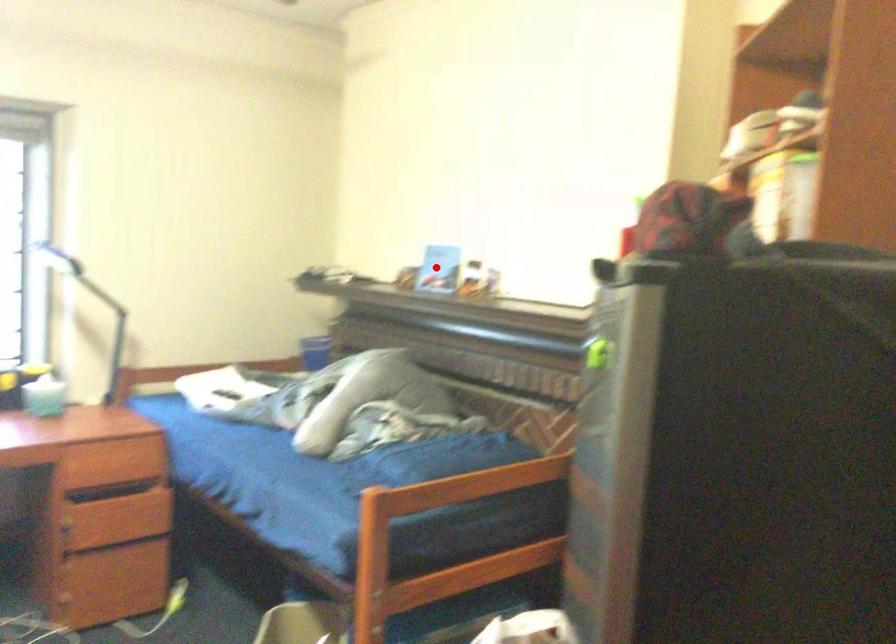
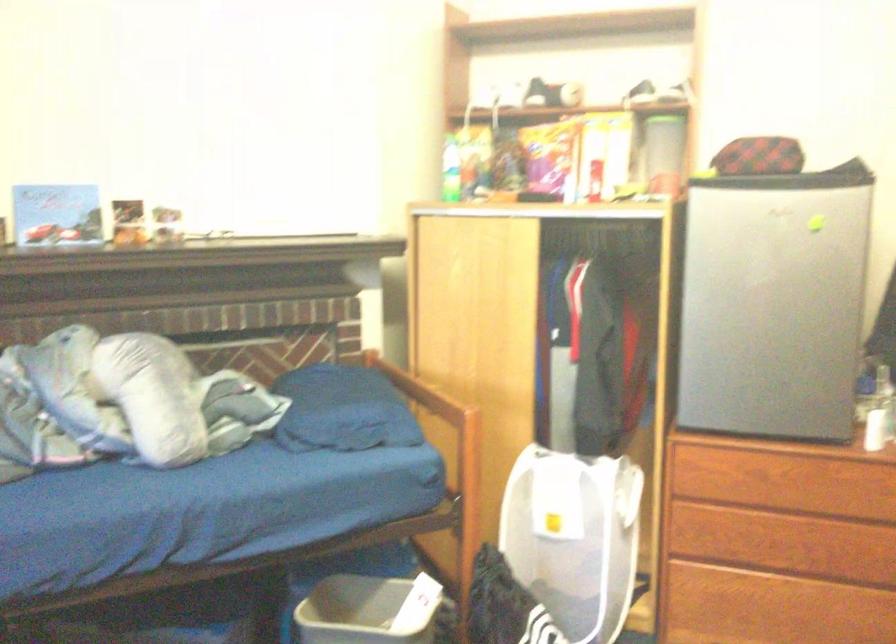
Question: I am providing you with two images of the same scene from different viewpoints. In image1, a red point is highlighted. Considering the same 3D point in image2, which of the following is correct?

Choices:
 (A) It is closer
 (B) It is farther

Answer: (A)